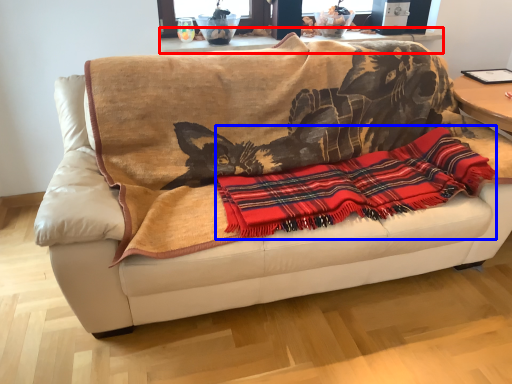
Question: Which object is closer to the camera taking this photo, table (highlighted by a red box) or cloth (highlighted by a blue box)?

Choices:
 (A) table
 (B) cloth

Answer: (B)